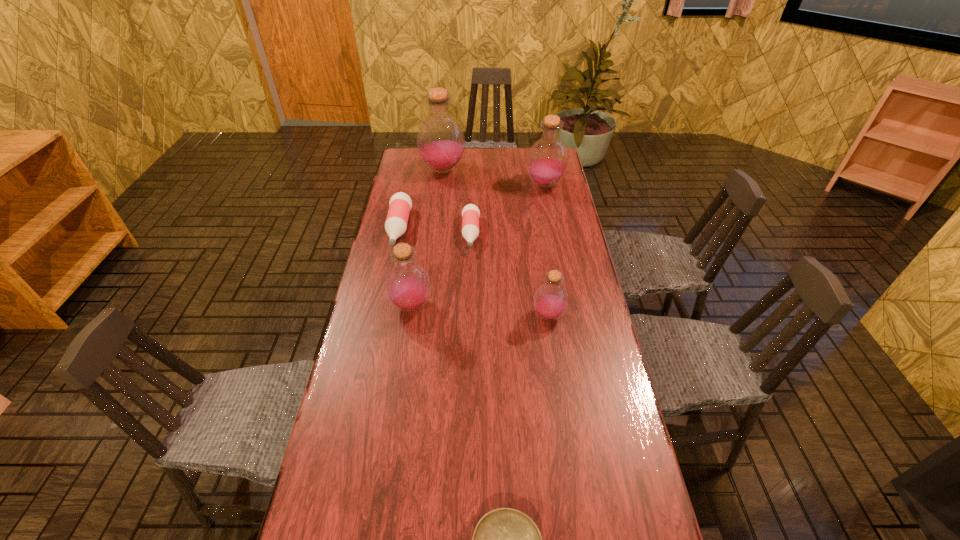
This screenshot has width=960, height=540. What are the coordinates of `the tallest object` in the screenshot? It's located at (440, 140).

This screenshot has width=960, height=540. What are the coordinates of `the tallest bottle` in the screenshot? It's located at (440, 140).

Find the location of a particular element. The width and height of the screenshot is (960, 540). the sixth shortest object is located at coordinates (547, 161).

This screenshot has width=960, height=540. I want to click on the second biggest purple bottle, so click(547, 161).

You are a GUI agent. You are given a task and a screenshot of the screen. Output one action in this format:
    pyautogui.click(x=<x>, y=<y>)
    Task: Click on the fourth shortest bottle
    
    Given the screenshot: What is the action you would take?
    pyautogui.click(x=407, y=285)

Where is `the fifth shortest object`? This screenshot has width=960, height=540. the fifth shortest object is located at coordinates (407, 285).

At what (x,y) coordinates should I click in order to perform the action: click on the fourth tallest bottle. Please return your answer as a coordinate pair (x, y). This screenshot has width=960, height=540. Looking at the image, I should click on (550, 302).

The height and width of the screenshot is (540, 960). I want to click on the fourth tallest object, so click(x=550, y=302).

This screenshot has height=540, width=960. Find the location of `the bigger pink bottle`. the bigger pink bottle is located at coordinates (400, 204).

Identify the location of the fifth tallest bottle. (400, 204).